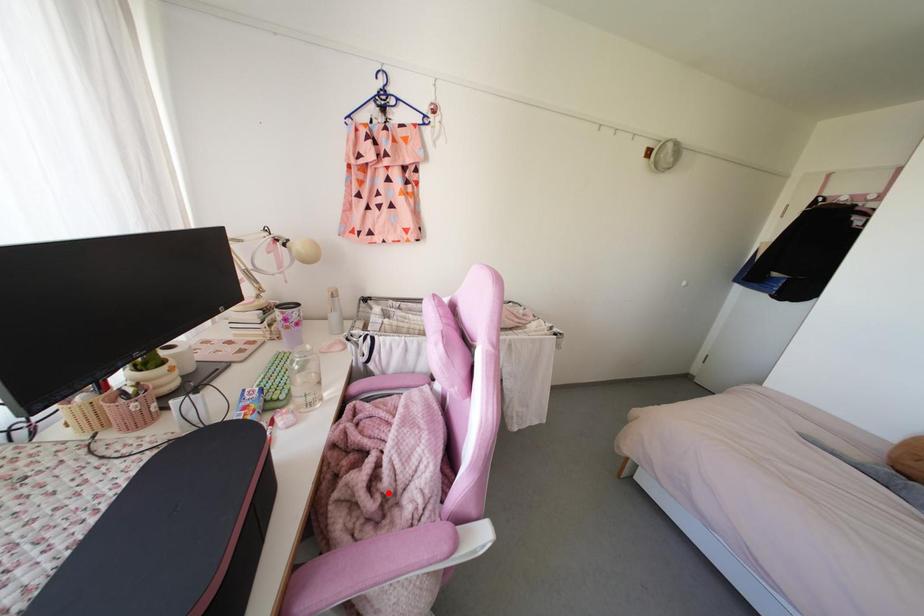
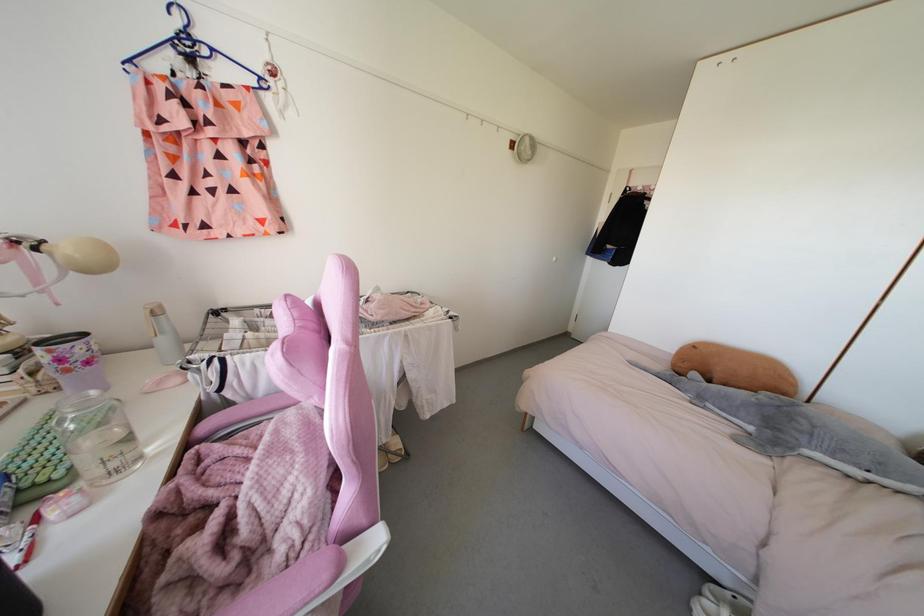
Question: I am providing you with two images of the same scene from different viewpoints. In image1, a red point is highlighted. Considering the same 3D point in image2, which of the following is correct?

Choices:
 (A) It is closer
 (B) It is farther

Answer: (A)